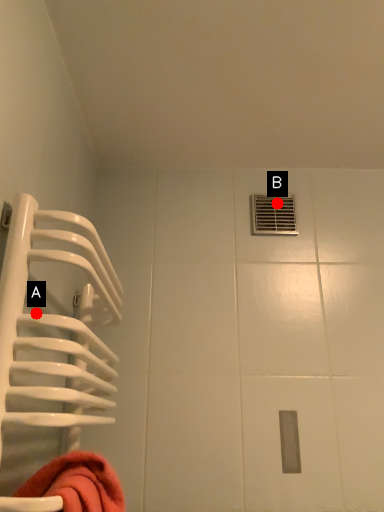
Question: Two points are circled on the image, labeled by A and B beside each circle. Which point is closer to the camera?

Choices:
 (A) A is closer
 (B) B is closer

Answer: (A)